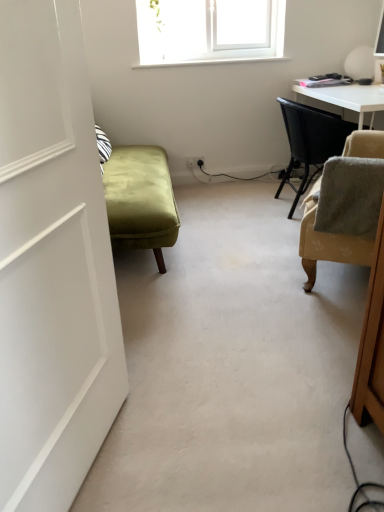
Question: Does beige fabric chair at right, which is the first chair from front to back, have a greater height compared to white matte door at left?

Choices:
 (A) no
 (B) yes

Answer: (A)

Question: Is white matte door at left surrounded by beige fabric chair at right, which is the first chair from front to back?

Choices:
 (A) no
 (B) yes

Answer: (A)

Question: Is beige fabric chair at right, which is the first chair from front to back, bigger than white matte door at left?

Choices:
 (A) no
 (B) yes

Answer: (A)

Question: From the image's perspective, does beige fabric chair at right, which is the first chair from front to back, appear lower than white matte door at left?

Choices:
 (A) no
 (B) yes

Answer: (A)

Question: Can you confirm if beige fabric chair at right, which is the first chair from front to back, is positioned to the right of white matte door at left?

Choices:
 (A) no
 (B) yes

Answer: (B)

Question: In the image, is beige fabric chair at right, the first chair when ordered from back to front, positioned in front of or behind white matte door at left?

Choices:
 (A) behind
 (B) front

Answer: (A)

Question: Is beige fabric chair at right, the 2th chair when ordered from front to back, situated inside white matte door at left or outside?

Choices:
 (A) inside
 (B) outside

Answer: (B)

Question: Considering the positions of beige fabric chair at right, the 2th chair when ordered from front to back, and white matte door at left in the image, is beige fabric chair at right, the 2th chair when ordered from front to back, wider or thinner than white matte door at left?

Choices:
 (A) thin
 (B) wide

Answer: (B)

Question: Would you say beige fabric chair at right, the 2th chair when ordered from front to back, is to the left or to the right of white matte door at left in the picture?

Choices:
 (A) left
 (B) right

Answer: (B)

Question: In terms of width, does white matte door at left look wider or thinner when compared to beige fabric chair at right, the first chair when ordered from back to front?

Choices:
 (A) wide
 (B) thin

Answer: (B)

Question: From a real-world perspective, is white matte door at left positioned above or below beige fabric chair at right, the first chair when ordered from back to front?

Choices:
 (A) below
 (B) above

Answer: (B)

Question: Looking at the image, does white matte door at left seem bigger or smaller compared to beige fabric chair at right, the 2th chair when ordered from front to back?

Choices:
 (A) small
 (B) big

Answer: (A)

Question: Do you think white matte door at left is within beige fabric chair at right, the first chair when ordered from back to front, or outside of it?

Choices:
 (A) outside
 (B) inside

Answer: (A)

Question: From the image's perspective, is beige fabric chair at right, which is the first chair from front to back, positioned above or below beige fabric chair at right, the 2th chair when ordered from front to back?

Choices:
 (A) above
 (B) below

Answer: (B)

Question: Is point (347, 138) closer or farther from the camera than point (294, 120)?

Choices:
 (A) farther
 (B) closer

Answer: (B)